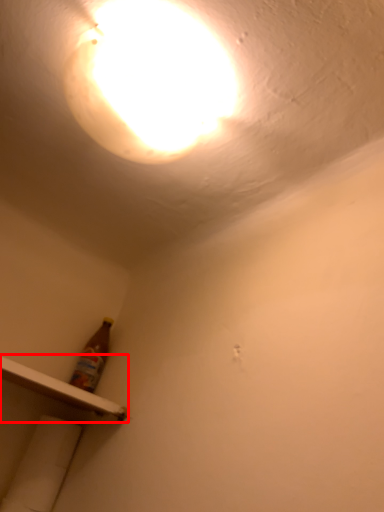
Question: Considering the relative positions of shelf (annotated by the red box) and lamp in the image provided, where is shelf (annotated by the red box) located with respect to the staircase?

Choices:
 (A) left
 (B) right

Answer: (A)